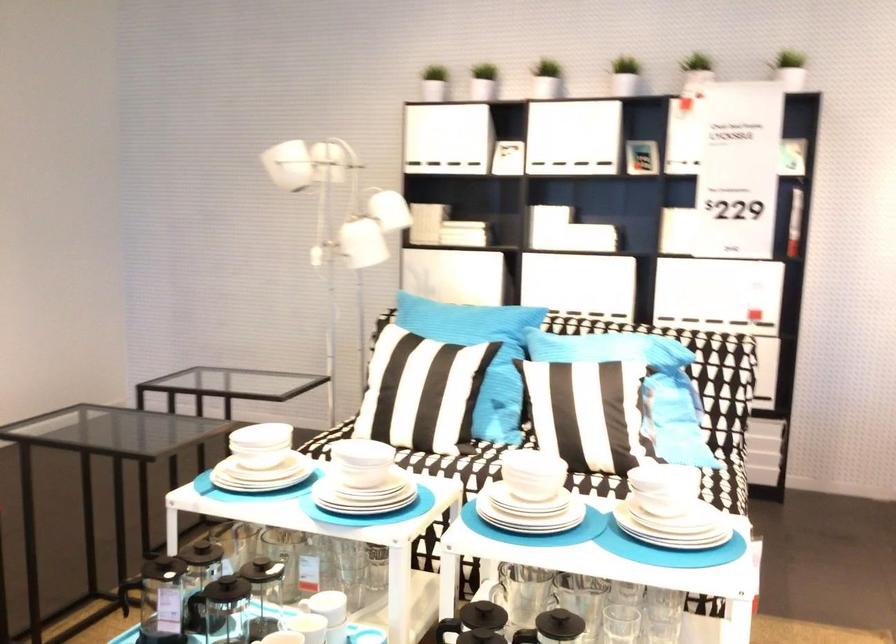
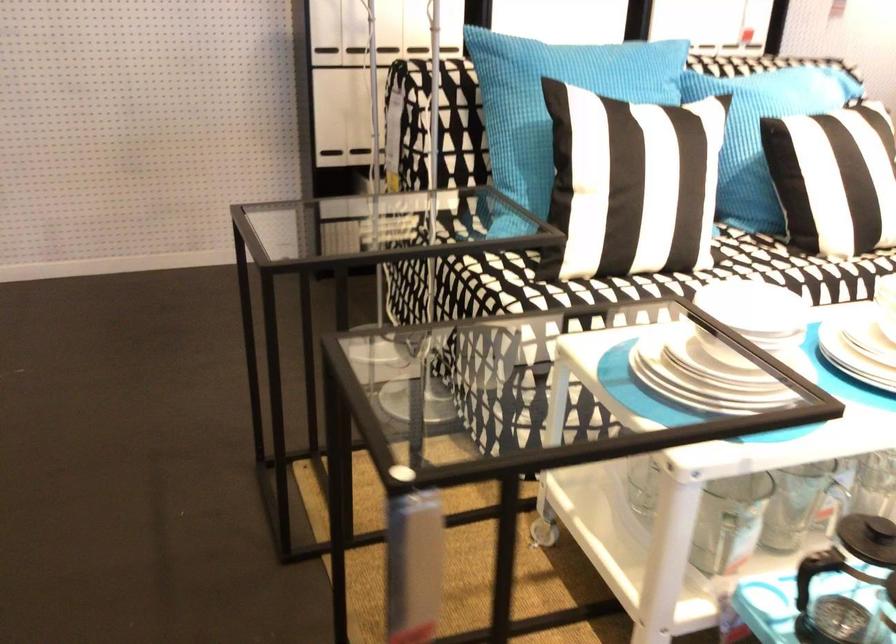
Locate, in the second image, the point that corresponds to point 252,469 in the first image.

(709, 373)